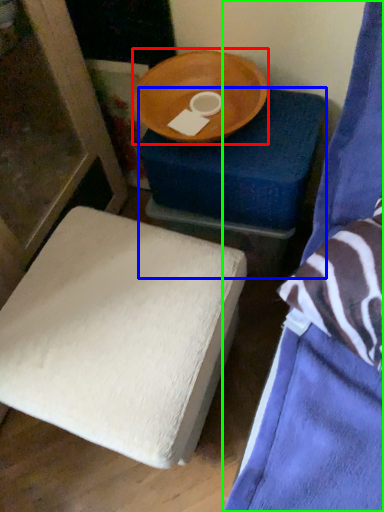
Question: Estimate the real-world distances between objects in this image. Which object is farther from round table (highlighted by a red box), furniture (highlighted by a blue box) or furniture (highlighted by a green box)?

Choices:
 (A) furniture
 (B) furniture

Answer: (B)